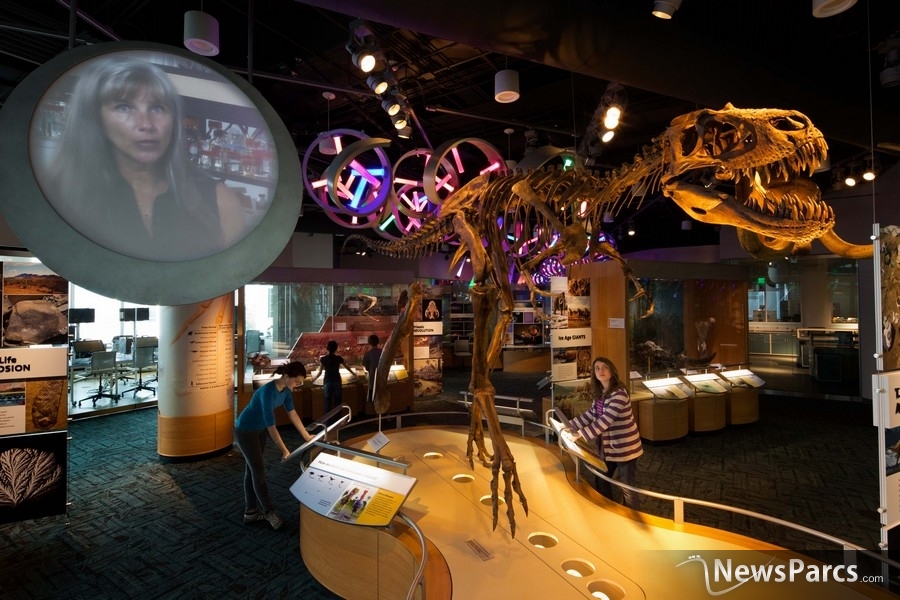
Find the location of `lights`. lights is located at coordinates (606, 585), (577, 569), (549, 542), (484, 494), (462, 474), (437, 458).